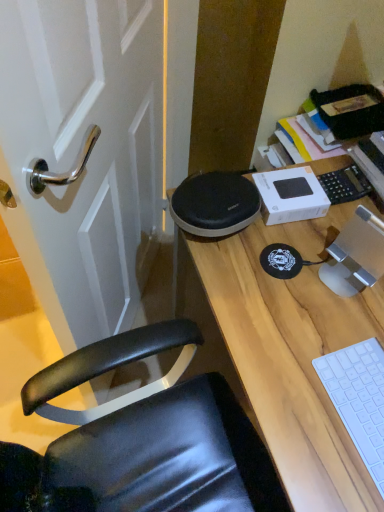
Locate an element on the screen. The image size is (384, 512). vacant space in white plastic keyboard at lower right (from a real-world perspective) is located at coordinates (363, 400).